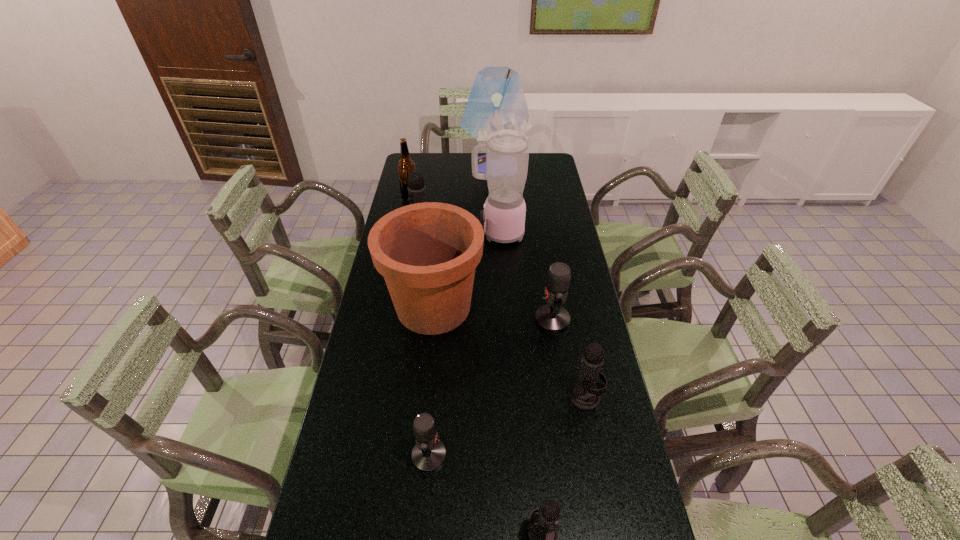
You are a GUI agent. You are given a task and a screenshot of the screen. Output one action in this format:
    pyautogui.click(x=<x>, y=<y>)
    Task: Click on the third nearest microphone
    The width and height of the screenshot is (960, 540).
    Given the screenshot: What is the action you would take?
    pyautogui.click(x=585, y=395)

Image resolution: width=960 pixels, height=540 pixels. I want to click on the smaller red microphone, so pos(429,453).

This screenshot has height=540, width=960. What are the coordinates of `the left red microphone` in the screenshot? It's located at (429, 453).

Locate an element on the screen. The height and width of the screenshot is (540, 960). free space located 0.220m on the base of the light lampshade is located at coordinates (415, 167).

Image resolution: width=960 pixels, height=540 pixels. Identify the location of free location located on the base of the light lampshade. (430, 167).

Where is `vacant space located 0.280m on the base of the light lampshade`? This screenshot has height=540, width=960. vacant space located 0.280m on the base of the light lampshade is located at coordinates (403, 167).

Find the location of a particular element. free space located 0.240m on the base of the food processor near the control knob is located at coordinates (412, 234).

Locate an element on the screen. Image resolution: width=960 pixels, height=540 pixels. free location located 0.080m on the base of the food processor near the control knob is located at coordinates [x=452, y=234].

At what (x,y) coordinates should I click in order to perform the action: click on free space located on the base of the food processor near the control knob. Please return your answer as a coordinate pair (x, y). This screenshot has height=540, width=960. Looking at the image, I should click on (452, 234).

Locate an element on the screen. This screenshot has height=540, width=960. vacant space located 0.090m on the back of the flowerpot is located at coordinates (439, 257).